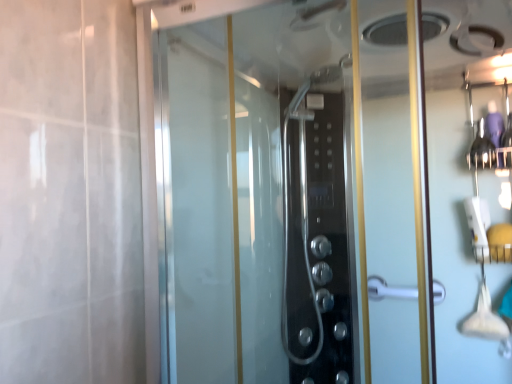
The height and width of the screenshot is (384, 512). Find the location of `transparent glass shower door at center`. transparent glass shower door at center is located at coordinates click(x=255, y=192).

Image resolution: width=512 pixels, height=384 pixels. Describe the element at coordinates (255, 192) in the screenshot. I see `transparent glass shower door at center` at that location.

Find the location of a particular element. The width and height of the screenshot is (512, 384). transparent glass shower door at center is located at coordinates (255, 192).